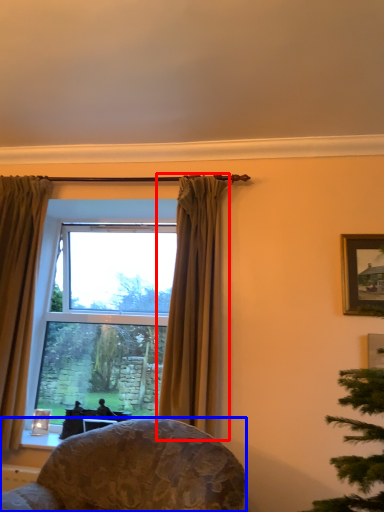
Question: Among these objects, which one is nearest to the camera, curtain (highlighted by a red box) or chair (highlighted by a blue box)?

Choices:
 (A) curtain
 (B) chair

Answer: (B)